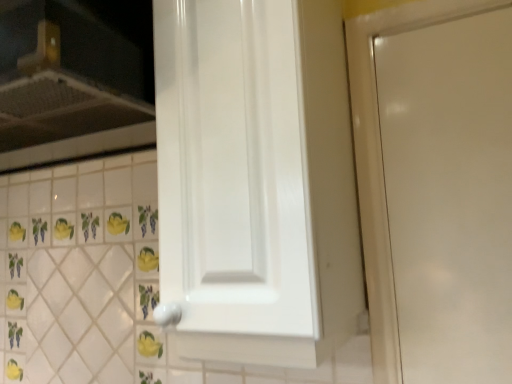
Question: Is white glossy cabinet door at center facing away from white glossy vent at upper left?

Choices:
 (A) no
 (B) yes

Answer: (A)

Question: From the image's perspective, is white glossy cabinet door at center below white glossy vent at upper left?

Choices:
 (A) no
 (B) yes

Answer: (B)

Question: Can you confirm if white glossy cabinet door at center is positioned to the right of white glossy vent at upper left?

Choices:
 (A) yes
 (B) no

Answer: (A)

Question: Can you confirm if white glossy cabinet door at center is taller than white glossy vent at upper left?

Choices:
 (A) no
 (B) yes

Answer: (B)

Question: Can we say white glossy cabinet door at center lies outside white glossy vent at upper left?

Choices:
 (A) no
 (B) yes

Answer: (B)

Question: Is white glossy cabinet door at center to the left of white glossy vent at upper left from the viewer's perspective?

Choices:
 (A) no
 (B) yes

Answer: (A)

Question: Considering the relative positions of white glossy vent at upper left and white glossy cabinet door at center in the image provided, is white glossy vent at upper left to the right of white glossy cabinet door at center from the viewer's perspective?

Choices:
 (A) yes
 (B) no

Answer: (B)

Question: Is white glossy vent at upper left closer to the viewer compared to white glossy cabinet door at center?

Choices:
 (A) yes
 (B) no

Answer: (B)

Question: From the image's perspective, does white glossy vent at upper left appear higher than white glossy cabinet door at center?

Choices:
 (A) yes
 (B) no

Answer: (A)

Question: Can you confirm if white glossy vent at upper left is shorter than white glossy cabinet door at center?

Choices:
 (A) no
 (B) yes

Answer: (B)

Question: From a real-world perspective, is white glossy vent at upper left beneath white glossy cabinet door at center?

Choices:
 (A) no
 (B) yes

Answer: (A)

Question: Is white glossy cabinet door at center inside white glossy vent at upper left?

Choices:
 (A) yes
 (B) no

Answer: (B)

Question: Considering the positions of white glossy cabinet door at center and white glossy vent at upper left in the image, is white glossy cabinet door at center wider or thinner than white glossy vent at upper left?

Choices:
 (A) wide
 (B) thin

Answer: (B)